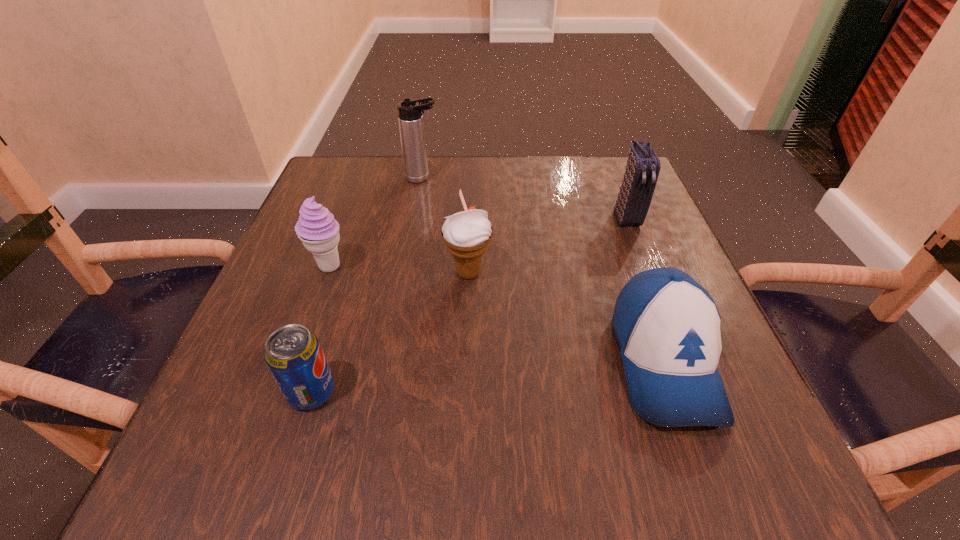
Identify the location of vacant area that lies between the soda and the baseball cap. Image resolution: width=960 pixels, height=540 pixels. (488, 377).

Image resolution: width=960 pixels, height=540 pixels. I want to click on vacant area between the soda and the farthest object, so click(x=368, y=285).

Where is `vacant area that lies between the thermos bottle and the second farthest object`? The width and height of the screenshot is (960, 540). vacant area that lies between the thermos bottle and the second farthest object is located at coordinates (524, 198).

Identify the location of vacant region between the clutch bag and the soda. (469, 305).

At what (x,y) coordinates should I click in order to perform the action: click on vacant area between the soda and the fourth object from right to left. Please return your answer as a coordinate pair (x, y). This screenshot has height=540, width=960. Looking at the image, I should click on (368, 285).

The width and height of the screenshot is (960, 540). What are the coordinates of `free space that is in between the baseball cap and the soda` in the screenshot? It's located at (488, 377).

Image resolution: width=960 pixels, height=540 pixels. What are the coordinates of `vacant area that lies between the fourth object from left to right and the soda` in the screenshot? It's located at (390, 333).

In order to click on vacant area between the soda and the farthest object in this screenshot , I will do `click(368, 285)`.

Image resolution: width=960 pixels, height=540 pixels. Identify the location of the fourth closest object to the left icecream. (667, 326).

Locate which object ranks fourth in proximity to the soda. Please provide its 2D coordinates. Your answer should be formatted as a tuple, i.e. [(x, y)], where the tuple contains the x and y coordinates of a point satisfying the conditions above.

[(410, 117)]